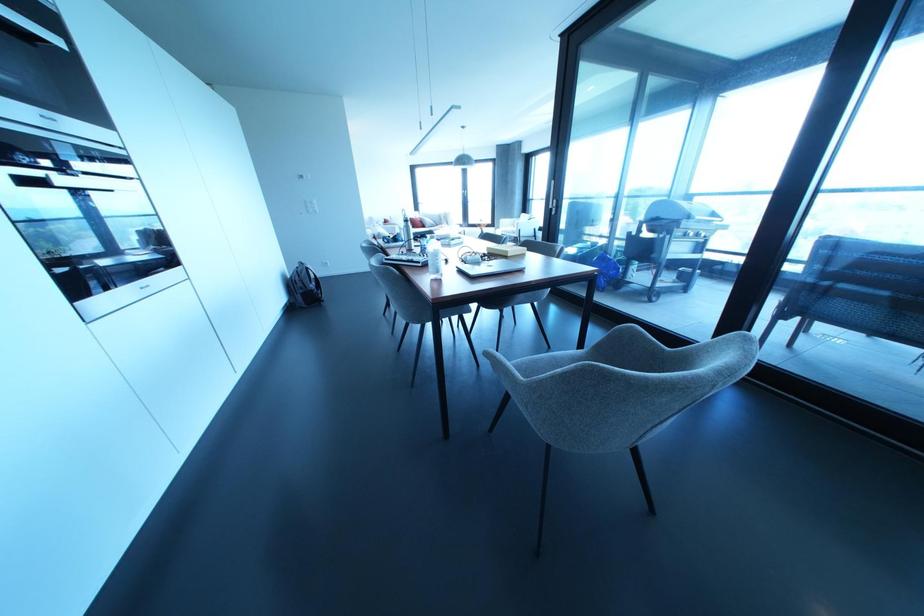
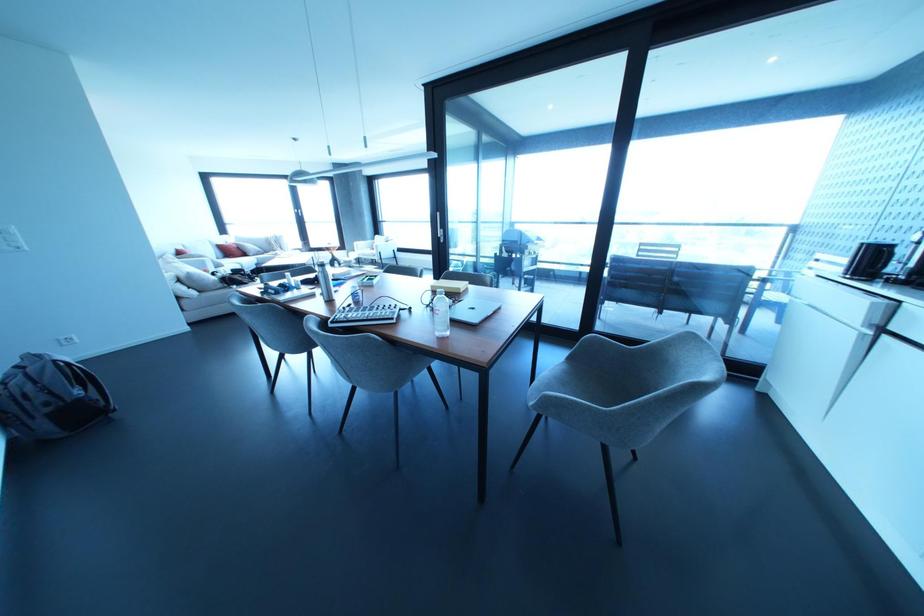
The point at [314,201] is marked in the first image. Where is the corresponding point in the second image?

(14, 229)